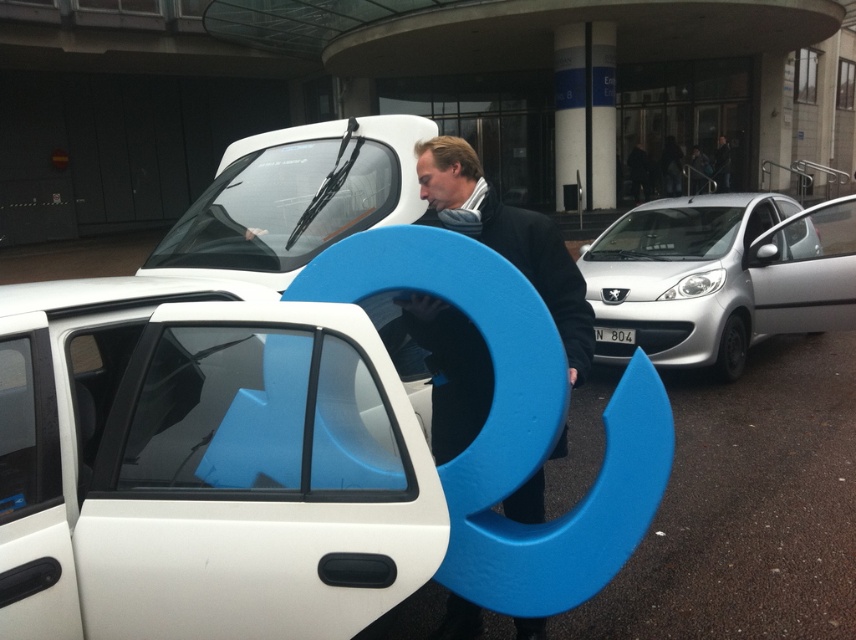
Question: Among these points, which one is nearest to the camera?

Choices:
 (A) (485, 413)
 (B) (629, 342)
 (C) (777, 268)

Answer: (A)

Question: Estimate the real-world distances between objects in this image. Which object is farther from the silver metallic car at right?

Choices:
 (A) white plastic license plate at center
 (B) white matte car door at center
 (C) white matte car at center

Answer: (B)

Question: Is silver metallic car at right bigger than white matte car at center?

Choices:
 (A) yes
 (B) no

Answer: (B)

Question: From the image, what is the correct spatial relationship of white matte car at center in relation to matte blue sculpture at center?

Choices:
 (A) above
 (B) below

Answer: (A)

Question: Among these objects, which one is farthest from the camera?

Choices:
 (A) white matte car at center
 (B) silver metallic car at right
 (C) white matte car door at center
 (D) matte blue sculpture at center

Answer: (B)

Question: Can you confirm if silver metallic car at right is wider than matte blue sculpture at center?

Choices:
 (A) yes
 (B) no

Answer: (A)